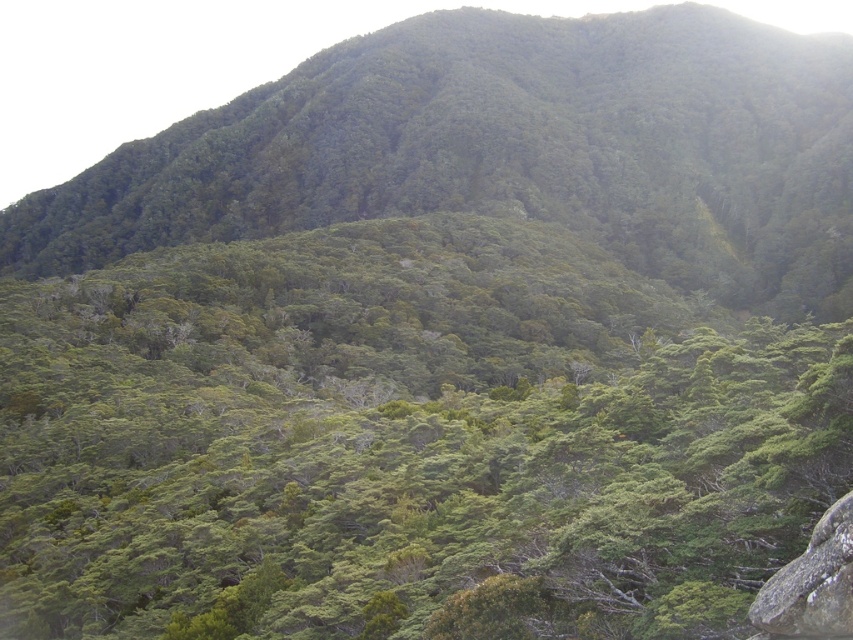
Question: Which point appears closest to the camera in this image?

Choices:
 (A) (138, 192)
 (B) (390, 323)
 (C) (840, 593)

Answer: (C)

Question: Is green leafy hillside at center bigger than gray rough rock at lower right?

Choices:
 (A) no
 (B) yes

Answer: (B)

Question: Is green leafy tree at center behind gray rough rock at lower right?

Choices:
 (A) yes
 (B) no

Answer: (A)

Question: Which point is closer to the camera taking this photo?

Choices:
 (A) (809, 208)
 (B) (605, 364)
 (C) (781, 605)

Answer: (C)

Question: Among these objects, which one is farthest from the camera?

Choices:
 (A) green leafy hillside at center
 (B) gray rough rock at lower right

Answer: (A)

Question: Can you confirm if green leafy hillside at center is positioned above gray rough rock at lower right?

Choices:
 (A) no
 (B) yes

Answer: (B)